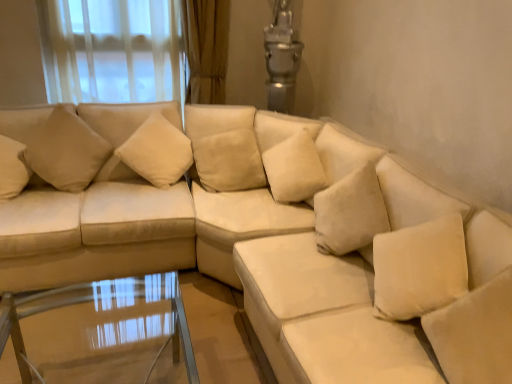
Question: In the image, is beige fabric pillow at upper left, the 4th pillow when ordered from right to left, on the left side or the right side of transparent glass table at lower center?

Choices:
 (A) left
 (B) right

Answer: (A)

Question: From the image's perspective, relative to transparent glass table at lower center, is beige fabric pillow at upper left, the 4th pillow when ordered from right to left, above or below?

Choices:
 (A) above
 (B) below

Answer: (A)

Question: Estimate the real-world distances between objects in this image. Which object is farther from the beige fabric pillow at center, placed as the 3th pillow when sorted from left to right?

Choices:
 (A) beige fabric pillow at upper left, which is the first pillow in left-to-right order
 (B) transparent glass table at lower center
 (C) soft white pillow at lower right, the fourth pillow in the left-to-right sequence
 (D) suede beige couch at left
 (E) beige fabric pillow at upper left, arranged as the 3th pillow when viewed from the right

Answer: (C)

Question: Which of these objects is positioned closest to the suede beige couch at left?

Choices:
 (A) transparent glass table at lower center
 (B) beige fabric pillow at upper left, the 4th pillow when ordered from right to left
 (C) beige fabric pillow at center, which is the second pillow in right-to-left order
 (D) beige fabric pillow at upper left, arranged as the 3th pillow when viewed from the right
 (E) soft white pillow at lower right, the 1th pillow from the right

Answer: (B)